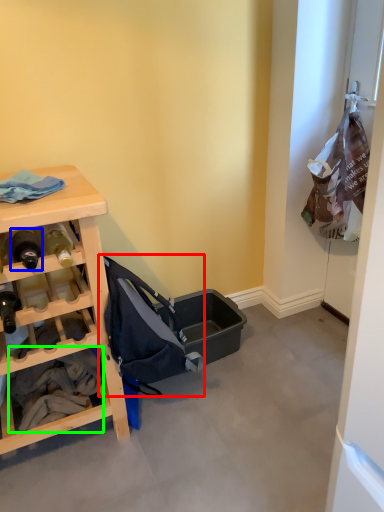
Question: Which object is the closest to the baby carriage (highlighted by a red box)? Choose among these: bottle (highlighted by a blue box) or clothing (highlighted by a green box).

Choices:
 (A) bottle
 (B) clothing

Answer: (B)